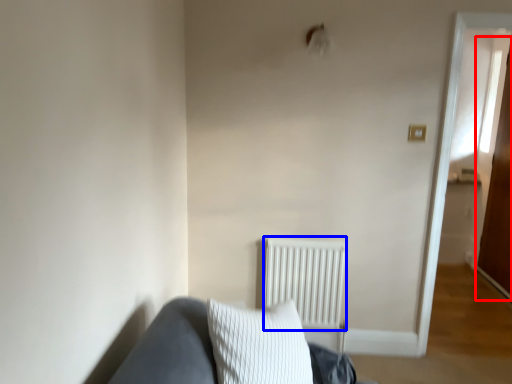
Question: Which of the following is the farthest to the observer, glass door (highlighted by a red box) or radiator (highlighted by a blue box)?

Choices:
 (A) glass door
 (B) radiator

Answer: (A)